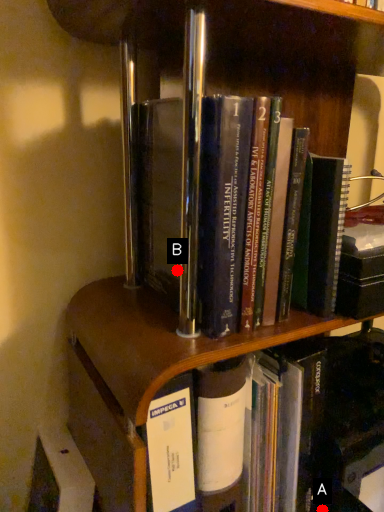
Question: Two points are circled on the image, labeled by A and B beside each circle. Which point appears closest to the camera in this image?

Choices:
 (A) A is closer
 (B) B is closer

Answer: (B)